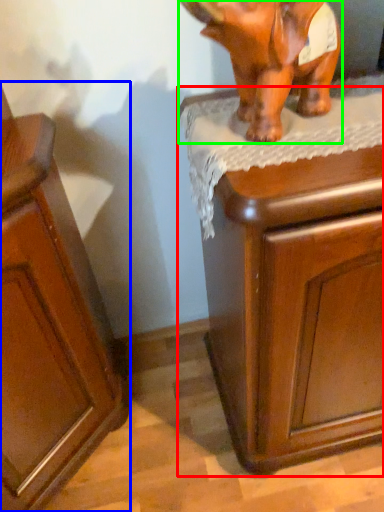
Question: Which object is the farthest from chest of drawers (highlighted by a red box)? Choose among these: cabinetry (highlighted by a blue box) or elephant (highlighted by a green box).

Choices:
 (A) cabinetry
 (B) elephant

Answer: (A)